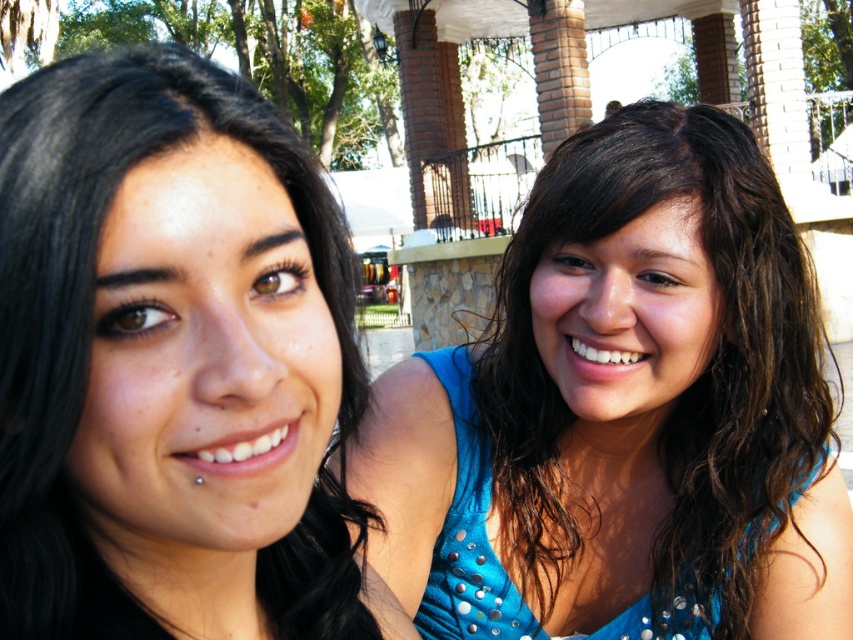
You are standing in front of the two people in the park. You want to take a photo that includes both of them clearly. Which point, point (627, 177) or point (263, 628), is closer to you and should be focused on to ensure both are in focus?

Point (627, 177) is closer to you than point (263, 628). To ensure both are in focus, focus on the closer point, point (627, 177), and adjust your camera settings for a wide depth of field.

You are a photographer trying to capture a clear shot of both the black hair at left and the blue sequined dress at right. Based on their positions, can you see both subjects fully without any obstruction?

The black hair at left is behind the blue sequined dress at right, so the black hair at left may be partially obscured by the blue sequined dress at right. Adjust your angle to ensure both are visible.